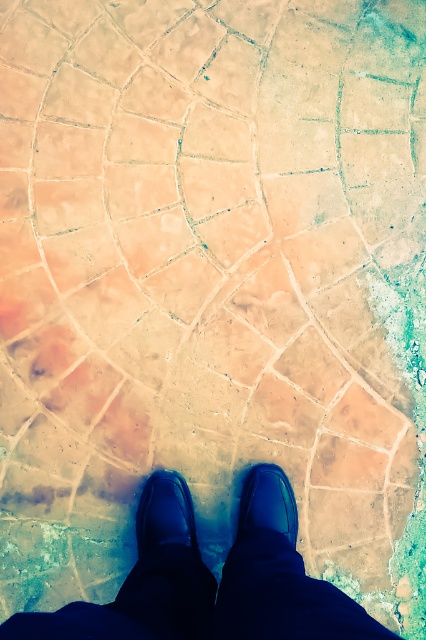
Is point (180, 540) positioned after point (290, 508)?

No, (180, 540) is closer to viewer.

Between point (150, 572) and point (249, 524), which one is positioned in front?

Point (150, 572)

Between point (134, 573) and point (275, 500), which one is positioned in front?

Point (134, 573)

At what (x,y) coordinates should I click in order to perform the action: click on black leather shoes at center. Please return your answer as a coordinate pair (x, y). The width and height of the screenshot is (426, 640). Looking at the image, I should click on (212, 579).

Does point (178, 532) lie behind point (296, 504)?

That is False.

Is shiny black shoe at center to the right of matte black shoe at center from the viewer's perspective?

Incorrect, shiny black shoe at center is not on the right side of matte black shoe at center.

Where is `shiny black shoe at center`? This screenshot has height=640, width=426. shiny black shoe at center is located at coordinates (164, 513).

At what (x,y) coordinates should I click in order to perform the action: click on shiny black shoe at center. Please return your answer as a coordinate pair (x, y). Looking at the image, I should click on (164, 513).

Who is more distant from viewer, [192,589] or [149,496]?

Point [149,496]

Does black leather shoes at center appear on the right side of shiny black shoe at center?

Indeed, black leather shoes at center is positioned on the right side of shiny black shoe at center.

Is point (117, 604) positioned in front of point (160, 477)?

Yes, point (117, 604) is in front of point (160, 477).

Where is `black leather shoes at center`? Image resolution: width=426 pixels, height=640 pixels. black leather shoes at center is located at coordinates (212, 579).